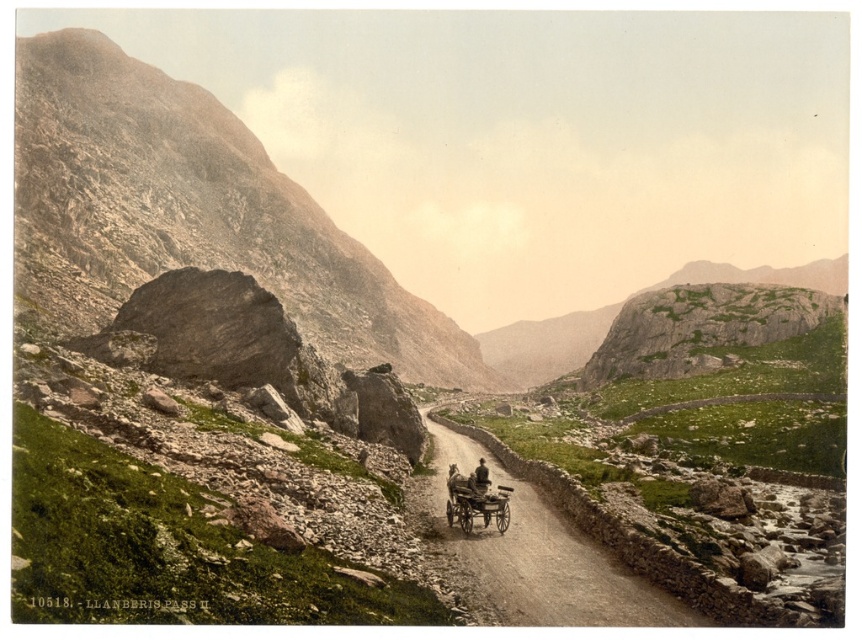
Question: Can you confirm if rusty rock at left is smaller than wooden cart at center?

Choices:
 (A) yes
 (B) no

Answer: (B)

Question: Can you confirm if wooden cart at center is wider than brown leather hat at center?

Choices:
 (A) no
 (B) yes

Answer: (A)

Question: Among these points, which one is nearest to the camera?

Choices:
 (A) (591, 625)
 (B) (490, 483)
 (C) (478, 506)
 (D) (75, 54)

Answer: (A)

Question: Which object is positioned closest to the wooden cart at center?

Choices:
 (A) brown leather hat at center
 (B) rusty rock at left
 (C) brown gravel road at center

Answer: (A)

Question: Is brown gravel road at center thinner than brown leather hat at center?

Choices:
 (A) yes
 (B) no

Answer: (B)

Question: Based on their relative distances, which object is nearer to the wooden cart at center?

Choices:
 (A) rusty rock at left
 (B) brown leather hat at center
 (C) brown gravel road at center

Answer: (B)